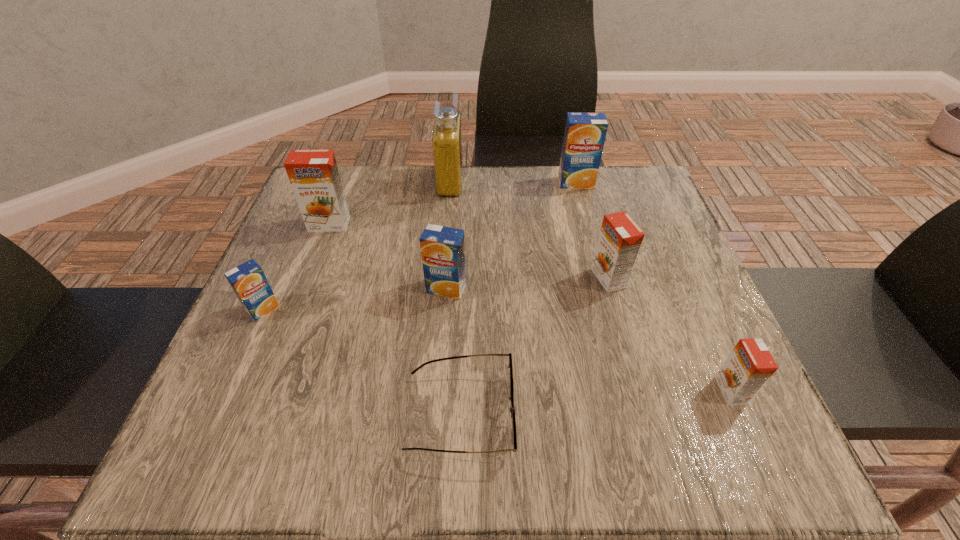
Where is `free spot located on the face of the spectacles`? The height and width of the screenshot is (540, 960). free spot located on the face of the spectacles is located at coordinates (736, 414).

You are a GUI agent. You are given a task and a screenshot of the screen. Output one action in this format:
    pyautogui.click(x=<x>, y=<y>)
    Task: Click on the perfume that is at the far edge
    The image size is (960, 540).
    Given the screenshot: What is the action you would take?
    pyautogui.click(x=447, y=149)

Find the location of a particular element. The image size is (960, 540). object at the near edge is located at coordinates (512, 409).

Locate an element on the screen. The height and width of the screenshot is (540, 960). object that is positioned at the far left corner is located at coordinates [x=313, y=174].

Find the location of a particular element. object that is at the far right corner is located at coordinates [x=585, y=133].

Where is `free spot at the far edge of the desktop`? The height and width of the screenshot is (540, 960). free spot at the far edge of the desktop is located at coordinates (494, 215).

Image resolution: width=960 pixels, height=540 pixels. In order to click on vacant space at the near edge of the desktop in this screenshot , I will do `click(579, 442)`.

Image resolution: width=960 pixels, height=540 pixels. In the image, there is a desktop. Find the location of `vacant space at the left edge`. vacant space at the left edge is located at coordinates (287, 249).

Locate an element on the screen. The height and width of the screenshot is (540, 960). free point at the near left corner is located at coordinates (291, 437).

This screenshot has height=540, width=960. Find the location of `vacant space at the far right corner`. vacant space at the far right corner is located at coordinates (649, 196).